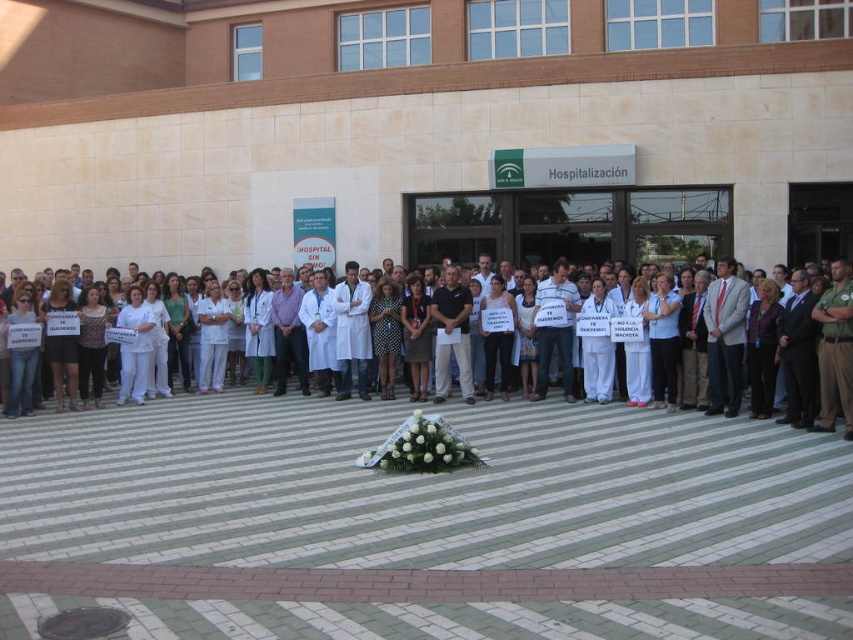
Consider the image. Measure the distance between white lab coats at center and camera.

white lab coats at center is 10.79 meters from camera.

Is white lab coats at center taller than brown uniform at right?

Incorrect, white lab coats at center's height is not larger of brown uniform at right's.

The width and height of the screenshot is (853, 640). What are the coordinates of `white lab coats at center` in the screenshot? It's located at (265, 413).